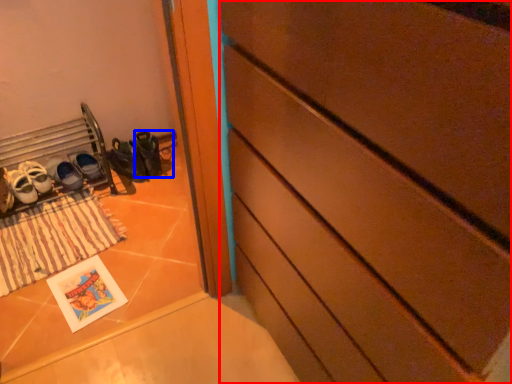
Question: Which object is further to the camera taking this photo, chest of drawers (highlighted by a red box) or shoe (highlighted by a blue box)?

Choices:
 (A) chest of drawers
 (B) shoe

Answer: (B)